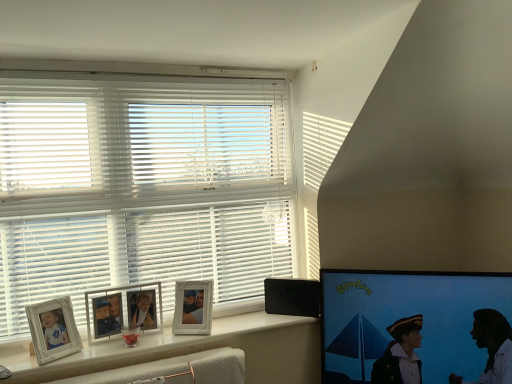
Where is `vacant space to the left of black plastic speaker at lower right`? vacant space to the left of black plastic speaker at lower right is located at coordinates (260, 315).